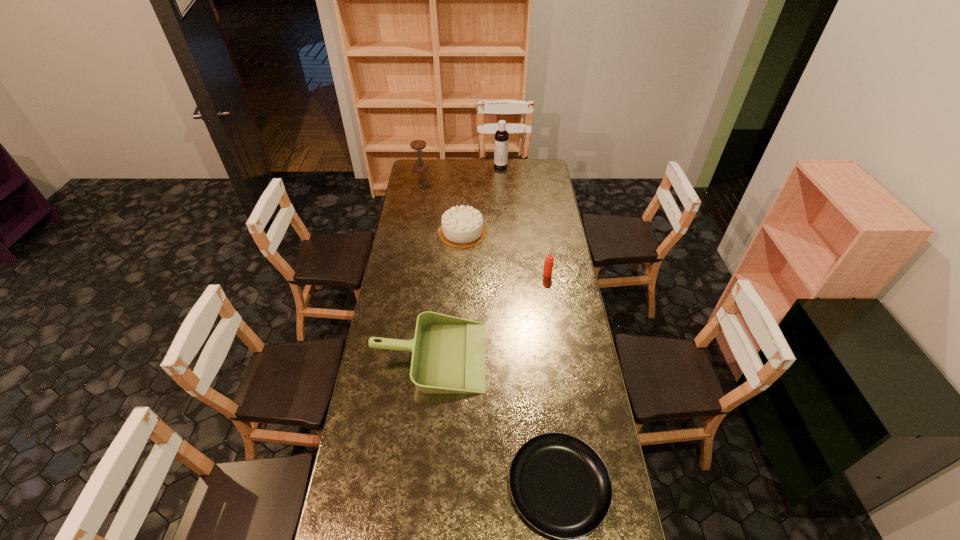
Image resolution: width=960 pixels, height=540 pixels. Find the location of `vacant space at the left edge of the desktop`. vacant space at the left edge of the desktop is located at coordinates (412, 246).

You are a GUI agent. You are given a task and a screenshot of the screen. Output one action in this format:
    pyautogui.click(x=<x>, y=<y>)
    Task: Click on the vacant region at the right edge
    
    Given the screenshot: What is the action you would take?
    pyautogui.click(x=613, y=498)

Locate an element on the screen. This screenshot has width=960, height=540. vacant space that's between the dustpan and the Tabasco sauce is located at coordinates (488, 315).

At what (x,y) coordinates should I click in order to perform the action: click on free point between the birthday cake and the dishwasher detergent. Please return your answer as a coordinate pair (x, y). This screenshot has width=960, height=540. Looking at the image, I should click on (482, 199).

The image size is (960, 540). What are the coordinates of `free space that is in between the fifth tallest object and the hourglass` in the screenshot? It's located at (424, 262).

The image size is (960, 540). In order to click on free space between the hourglass and the Tabasco sauce in this screenshot , I will do `click(484, 221)`.

The image size is (960, 540). Find the location of `empty space between the third nearest object and the dishwasher detergent`. empty space between the third nearest object and the dishwasher detergent is located at coordinates (524, 220).

Select which object appears as the closest to the hourglass. Please provide its 2D coordinates. Your answer should be formatted as a tuple, i.e. [(x, y)], where the tuple contains the x and y coordinates of a point satisfying the conditions above.

[(501, 135)]

Locate an element on the screen. The width and height of the screenshot is (960, 540). object that can be found as the third closest to the third farthest object is located at coordinates (448, 353).

This screenshot has height=540, width=960. What are the coordinates of `vacant point that satisfies the following two spatial constraints: 1. on the label side of the dishwasher detergent; 2. on the front side of the hourglass` in the screenshot? It's located at (501, 167).